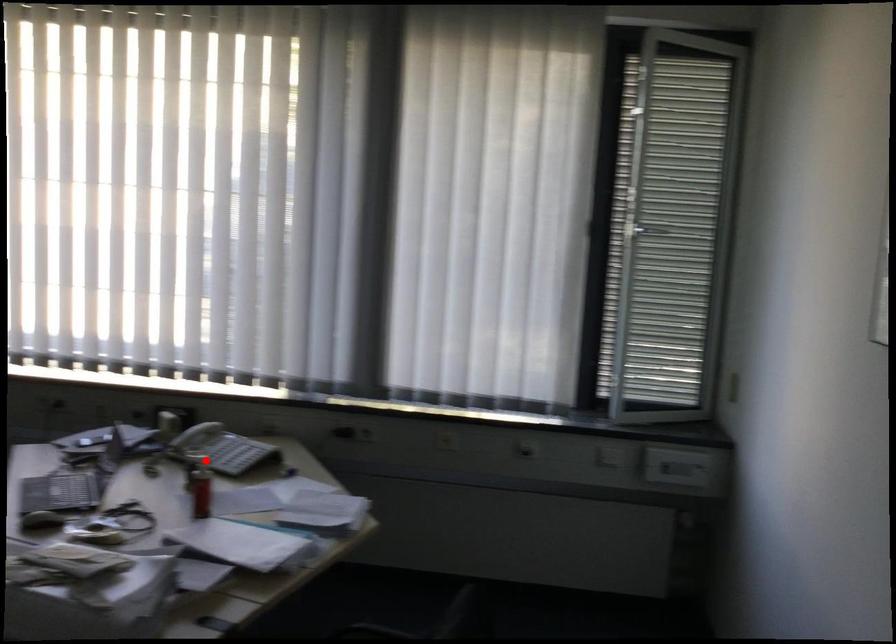
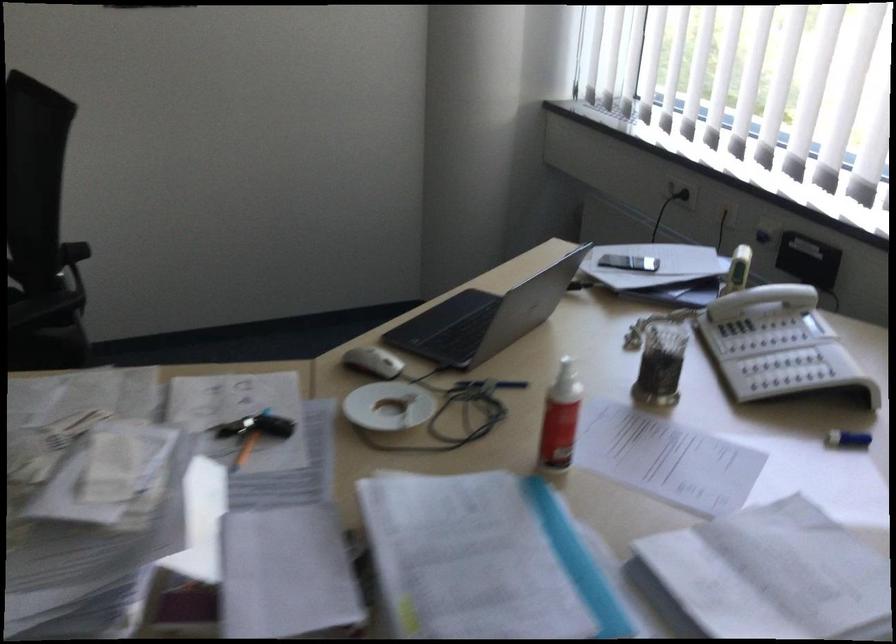
Question: I am providing you with two images of the same scene from different viewpoints. Image1 has a red point marked. In image2, the corresponding 3D location appears at what relative position? Reply with the corresponding letter.

Choices:
 (A) Closer
 (B) Farther

Answer: (A)